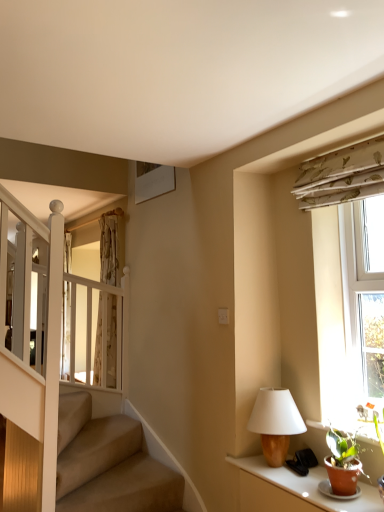
Describe the element at coordinates (293, 490) in the screenshot. I see `matte brown table at lower right` at that location.

The image size is (384, 512). What are the coordinates of `white textured window at right` in the screenshot? It's located at (347, 283).

Locate an element on the screen. This screenshot has height=512, width=384. wooden table lamp at right is located at coordinates (275, 423).

In order to click on floral fabric curtain at upper right in this screenshot , I will do (342, 175).

This screenshot has width=384, height=512. What do you see at coordinates (342, 175) in the screenshot?
I see `floral fabric curtain at upper right` at bounding box center [342, 175].

This screenshot has height=512, width=384. Find the location of `matte brown table at lower right`. matte brown table at lower right is located at coordinates (293, 490).

Is translucent fabric curtain at upper left turned away from wooden table lamp at right?

No.

Which of these two, translucent fabric curtain at upper left or wooden table lamp at right, is smaller?

wooden table lamp at right.

Would you say translucent fabric curtain at upper left is a long distance from wooden table lamp at right?

Yes.

From the image's perspective, does floral fabric curtain at upper right appear lower than white textured window at right?

No.

Are floral fabric curtain at upper right and white textured window at right located far from each other?

They are positioned close to each other.

Is floral fabric curtain at upper right taller than white textured window at right?

Incorrect, the height of floral fabric curtain at upper right is not larger of that of white textured window at right.

Considering the points (299, 198) and (377, 170), which point is in front, point (299, 198) or point (377, 170)?

Point (377, 170)

Is the surface of floral fabric curtain at upper right in direct contact with wooden table lamp at right?

No, floral fabric curtain at upper right is not beside wooden table lamp at right.

Is wooden table lamp at right surrounded by floral fabric curtain at upper right?

No, wooden table lamp at right is not a part of floral fabric curtain at upper right.

From the picture: From the image's perspective, does floral fabric curtain at upper right appear lower than wooden table lamp at right?

Actually, floral fabric curtain at upper right appears above wooden table lamp at right in the image.

Considering the points (371, 177) and (270, 464), which point is behind, point (371, 177) or point (270, 464)?

Positioned behind is point (270, 464).

Considering the positions of objects wooden table lamp at right and translucent fabric curtain at upper left in the image provided, who is in front, wooden table lamp at right or translucent fabric curtain at upper left?

Positioned in front is wooden table lamp at right.

In order to click on table lamp below the translucent fabric curtain at upper left (from the image's perspective) in this screenshot , I will do `click(275, 423)`.

Can you confirm if wooden table lamp at right is bigger than translucent fabric curtain at upper left?

Actually, wooden table lamp at right might be smaller than translucent fabric curtain at upper left.

Is wooden table lamp at right next to translucent fabric curtain at upper left?

No, wooden table lamp at right is not making contact with translucent fabric curtain at upper left.

Is wooden table lamp at right not near floral fabric curtain at upper right?

wooden table lamp at right is positioned a significant distance from floral fabric curtain at upper right.

Is wooden table lamp at right positioned before floral fabric curtain at upper right?

No, wooden table lamp at right is further to the viewer.

Measure the distance between wooden table lamp at right and floral fabric curtain at upper right.

wooden table lamp at right and floral fabric curtain at upper right are 1.15 meters apart from each other.

Which is further, (269,450) or (370,188)?

Positioned behind is point (269,450).

Are wooden table lamp at right and matte brown table at lower right making contact?

No, wooden table lamp at right is not beside matte brown table at lower right.

From the picture: Which point is more forward, (x=258, y=406) or (x=307, y=505)?

The point (x=307, y=505) is in front.

Could you tell me if wooden table lamp at right is turned towards matte brown table at lower right?

No, wooden table lamp at right is not oriented towards matte brown table at lower right.

Looking at their sizes, would you say wooden table lamp at right is wider or thinner than matte brown table at lower right?

Considering their sizes, wooden table lamp at right looks slimmer than matte brown table at lower right.

From the image's perspective, is white textured window at right above or below wooden table lamp at right?

white textured window at right is situated higher than wooden table lamp at right in the image.

Are white textured window at right and wooden table lamp at right located far from each other?

Actually, white textured window at right and wooden table lamp at right are a little close together.

Considering the positions of objects white textured window at right and wooden table lamp at right in the image provided, who is more to the right, white textured window at right or wooden table lamp at right?

From the viewer's perspective, white textured window at right appears more on the right side.

Locate an element on the screen. This screenshot has width=384, height=512. glass door located behind the wooden table lamp at right is located at coordinates (101, 312).

The width and height of the screenshot is (384, 512). I want to click on window on the right of floral fabric curtain at upper right, so click(347, 283).

Looking at the image, which one is located closer to wooden table lamp at right, translucent fabric curtain at upper left or floral fabric curtain at upper right?

floral fabric curtain at upper right lies closer to wooden table lamp at right than the other object.

When comparing their distances from wooden table lamp at right, does matte brown table at lower right or translucent fabric curtain at upper left seem closer?

Among the two, matte brown table at lower right is located nearer to wooden table lamp at right.

Looking at the image, which one is located closer to translucent fabric curtain at upper left, wooden table lamp at right or floral fabric curtain at upper right?

wooden table lamp at right.

When comparing their distances from matte brown table at lower right, does translucent fabric curtain at upper left or wooden table lamp at right seem closer?

wooden table lamp at right is positioned closer to the anchor matte brown table at lower right.

Looking at the image, which one is located further to white textured window at right, translucent fabric curtain at upper left or matte brown table at lower right?

Among the two, translucent fabric curtain at upper left is located further to white textured window at right.

When comparing their distances from translucent fabric curtain at upper left, does floral fabric curtain at upper right or wooden table lamp at right seem closer?

Among the two, wooden table lamp at right is located nearer to translucent fabric curtain at upper left.

When comparing their distances from floral fabric curtain at upper right, does translucent fabric curtain at upper left or matte brown table at lower right seem further?

Based on the image, translucent fabric curtain at upper left appears to be further to floral fabric curtain at upper right.

When comparing their distances from matte brown table at lower right, does floral fabric curtain at upper right or translucent fabric curtain at upper left seem closer?

Based on the image, floral fabric curtain at upper right appears to be nearer to matte brown table at lower right.

In order to click on table lamp between translucent fabric curtain at upper left and white textured window at right in this screenshot , I will do `click(275, 423)`.

Locate an element on the screen. window between floral fabric curtain at upper right and wooden table lamp at right from top to bottom is located at coordinates (347, 283).

Identify the location of curtain positioned between matte brown table at lower right and translucent fabric curtain at upper left from near to far. (342, 175).

Locate an element on the screen. window between floral fabric curtain at upper right and matte brown table at lower right in the vertical direction is located at coordinates (347, 283).